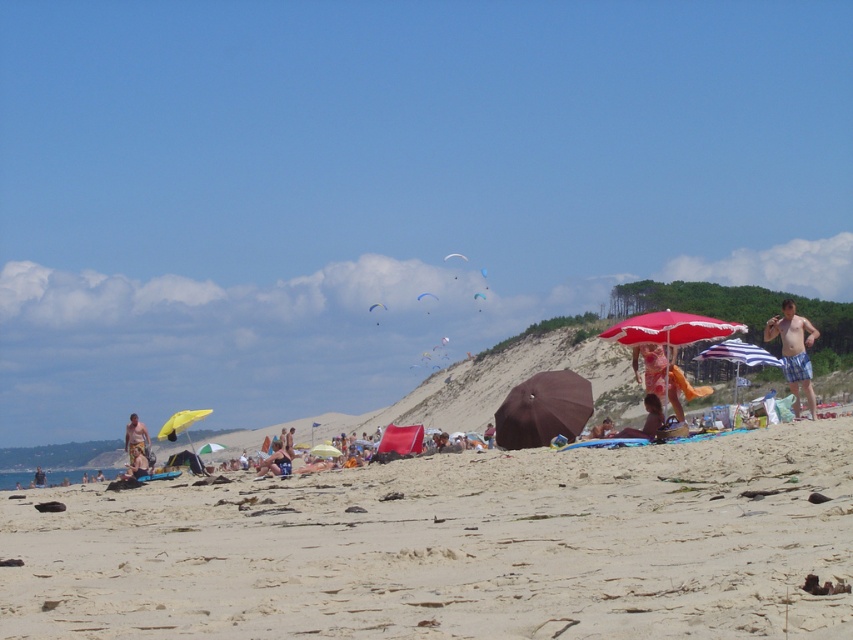
You are a photographer taking a picture of the beach scene. You notice the printed cotton dress at center and the smooth tan skin at center in your frame. Which object should you focus on to ensure the other is in the background?

You should focus on the printed cotton dress at center because it is closer to the viewer than the smooth tan skin at center, so if you focus on it, the smooth tan skin at center will be in the background.